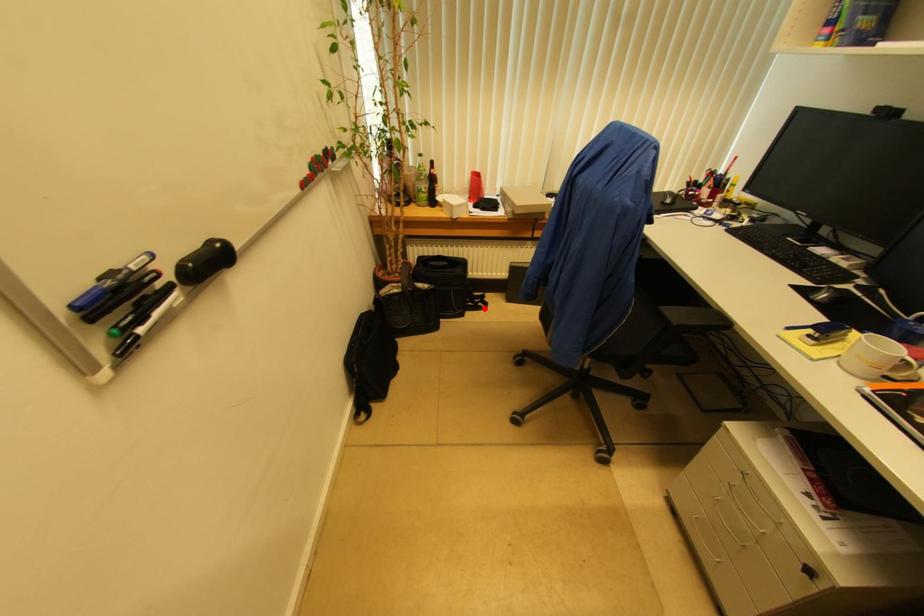
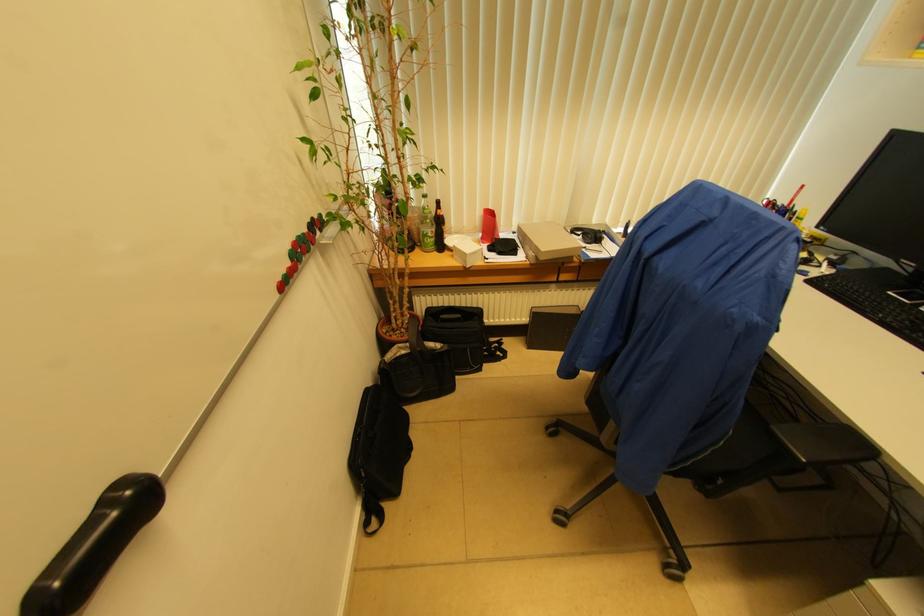
Locate, in the second image, the point that corresponds to the highlighted location in the first image.

(503, 358)